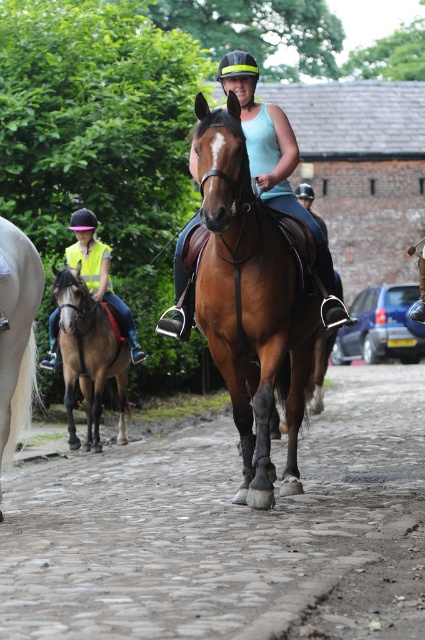
Question: Which is nearer to the yellow reflective vest at left?

Choices:
 (A) brown glossy horse at center
 (B) white glossy horse at left
 (C) brown cobblestone at center
 (D) brown glossy horse at left

Answer: (D)

Question: Which point is closer to the camera taking this photo?

Choices:
 (A) (107, 294)
 (B) (272, 129)

Answer: (B)

Question: Can you confirm if brown glossy horse at left is positioned to the right of yellow reflective vest at left?

Choices:
 (A) no
 (B) yes

Answer: (B)

Question: Among these objects, which one is nearest to the camera?

Choices:
 (A) brown cobblestone at center
 (B) brown glossy horse at center
 (C) matte brown horse at center
 (D) yellow reflective vest at left

Answer: (A)

Question: Is brown cobblestone at center positioned at the back of yellow reflective vest at left?

Choices:
 (A) yes
 (B) no

Answer: (B)

Question: Is brown cobblestone at center below brown glossy horse at center?

Choices:
 (A) no
 (B) yes

Answer: (B)